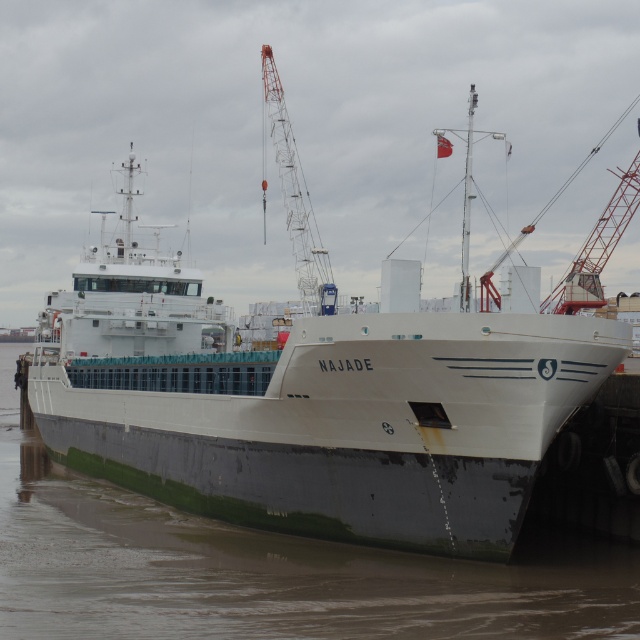
Question: Which point appears farthest from the camera in this image?

Choices:
 (A) (332, 289)
 (B) (198, 376)
 (C) (221, 588)

Answer: (A)

Question: Which is nearer to the green matte water at lower left?

Choices:
 (A) red painted metal crane at center
 (B) white matte ship at center

Answer: (B)

Question: Observing the image, what is the correct spatial positioning of green matte water at lower left in reference to red painted metal crane at center?

Choices:
 (A) left
 (B) right

Answer: (A)

Question: Is white matte ship at center below green matte water at lower left?

Choices:
 (A) yes
 (B) no

Answer: (B)

Question: Is the position of white matte ship at center less distant than that of green matte water at lower left?

Choices:
 (A) yes
 (B) no

Answer: (B)

Question: Which object is the farthest from the red painted metal crane at center?

Choices:
 (A) green matte water at lower left
 (B) white matte ship at center

Answer: (A)